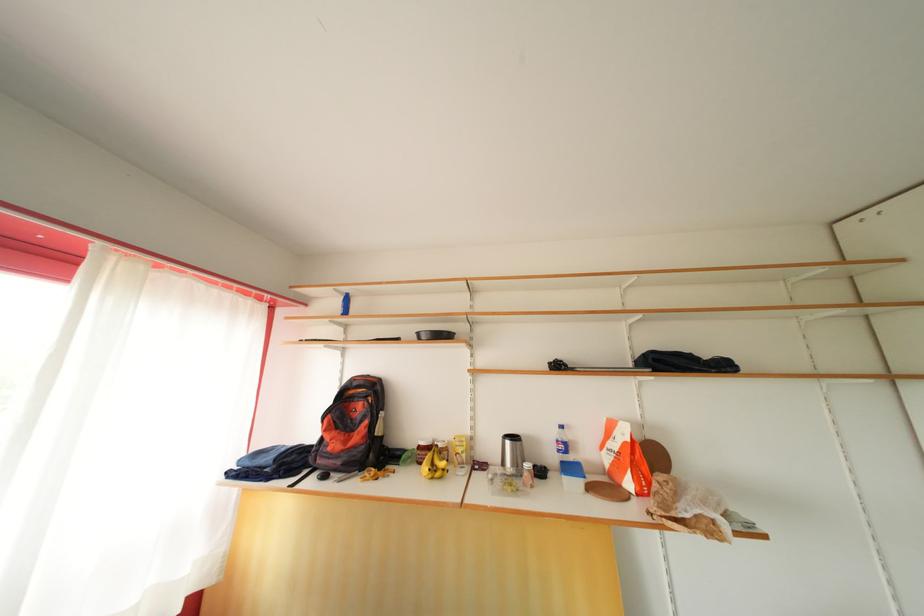
Where would you lift the glass food jar? Please return your answer as a coordinate pair (x, y).

(509, 480)